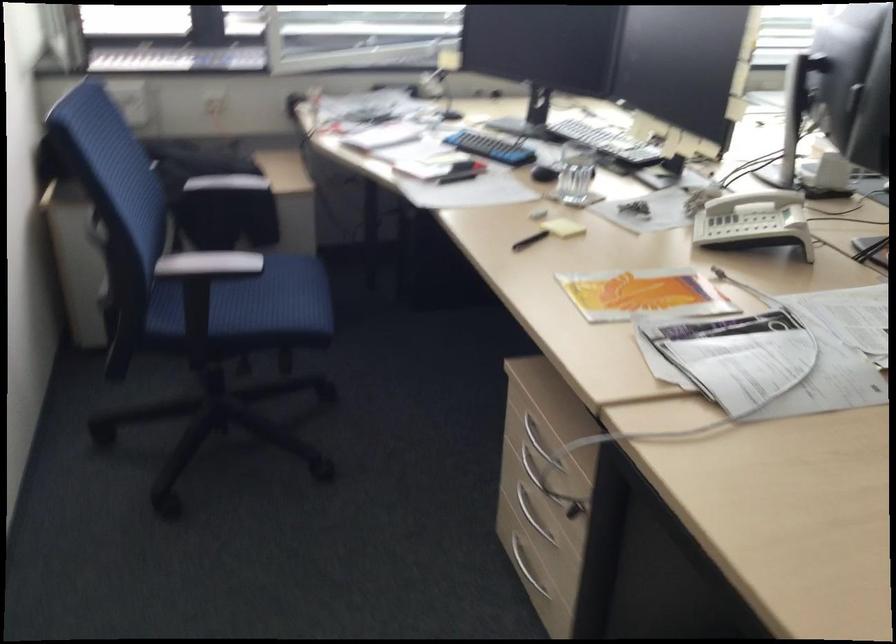
Find where to resting arm the white chair armrest. Please return your answer as a coordinate pair (x, y).

(227, 184)